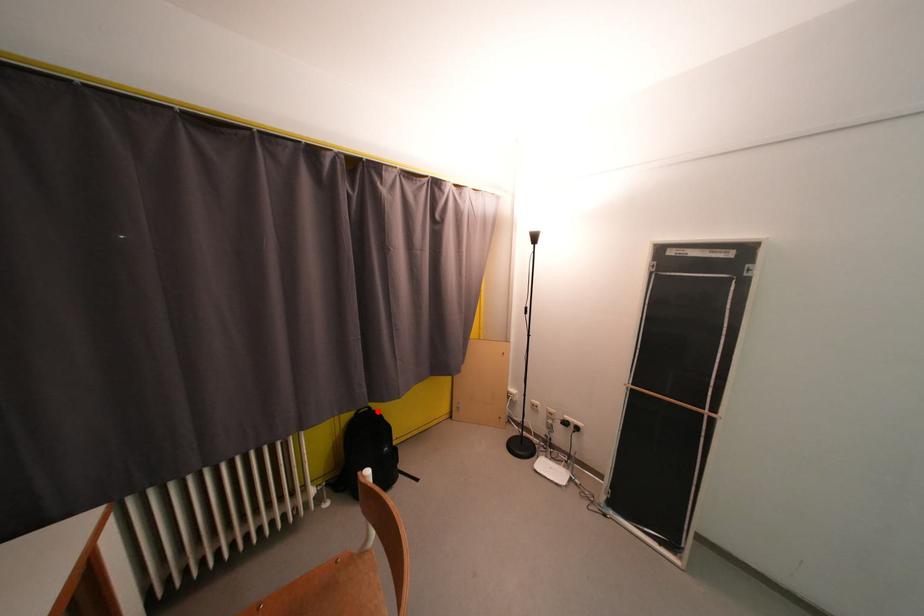
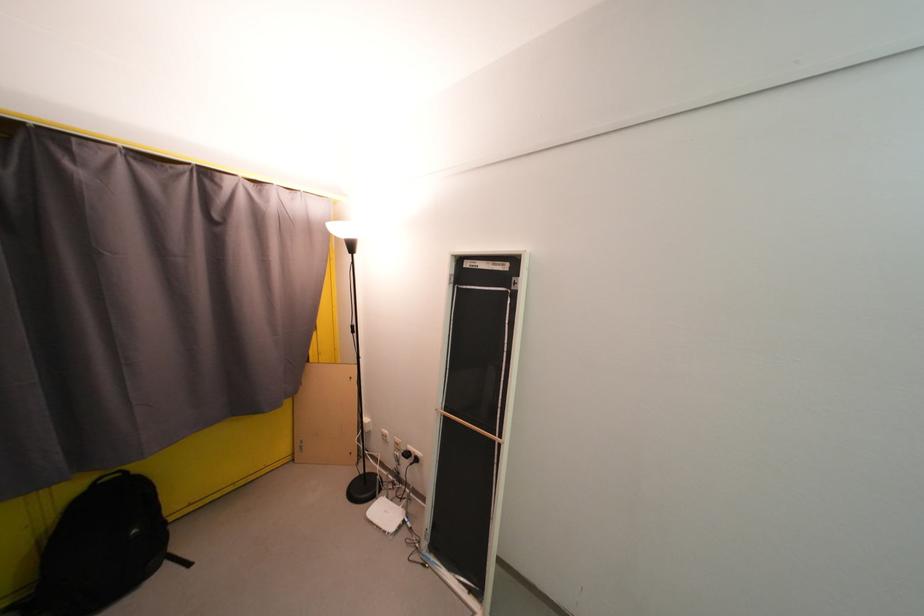
Question: A red point is marked in image1. In image2, is the corresponding 3D point closer to the camera or farther? Reply with the corresponding letter.

Choices:
 (A) The corresponding 3D point is closer.
 (B) The corresponding 3D point is farther.

Answer: (A)